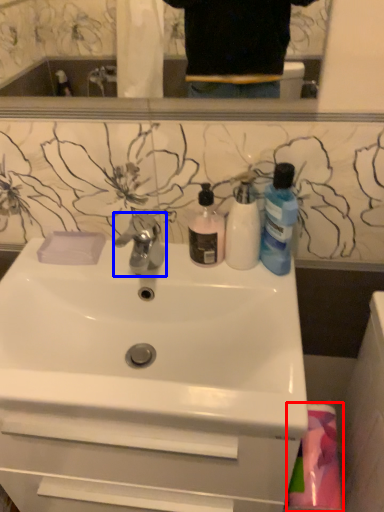
Question: Among these objects, which one is nearest to the camera, material (highlighted by a red box) or tap (highlighted by a blue box)?

Choices:
 (A) material
 (B) tap

Answer: (A)